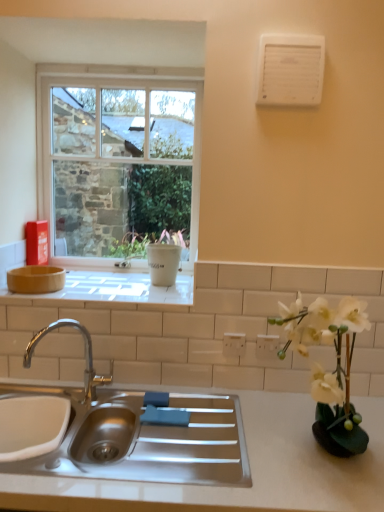
Question: In which direction should I rotate to look at white plastic electric outlet at center, placed as the second electric outlet when sorted from right to left?

Choices:
 (A) right
 (B) left

Answer: (A)

Question: Is white matte vase at right to the left of stainless steel sink at center from the viewer's perspective?

Choices:
 (A) no
 (B) yes

Answer: (A)

Question: Considering the relative sizes of white matte vase at right and stainless steel sink at center in the image provided, is white matte vase at right shorter than stainless steel sink at center?

Choices:
 (A) yes
 (B) no

Answer: (B)

Question: Is white matte vase at right at the right side of stainless steel sink at center?

Choices:
 (A) yes
 (B) no

Answer: (A)

Question: From the image's perspective, does white matte vase at right appear lower than stainless steel sink at center?

Choices:
 (A) yes
 (B) no

Answer: (B)

Question: From a real-world perspective, is white matte vase at right beneath stainless steel sink at center?

Choices:
 (A) yes
 (B) no

Answer: (B)

Question: Is white matte vase at right oriented away from stainless steel sink at center?

Choices:
 (A) yes
 (B) no

Answer: (B)

Question: From a real-world perspective, is white matte vase at upper center on stainless steel sink at center?

Choices:
 (A) no
 (B) yes

Answer: (B)

Question: From a real-world perspective, is white matte vase at upper center beneath stainless steel sink at center?

Choices:
 (A) no
 (B) yes

Answer: (A)

Question: From the image's perspective, is white matte vase at upper center beneath stainless steel sink at center?

Choices:
 (A) no
 (B) yes

Answer: (A)

Question: Could you tell me if white matte vase at upper center is facing stainless steel sink at center?

Choices:
 (A) yes
 (B) no

Answer: (B)

Question: Can you confirm if white matte vase at upper center is thinner than stainless steel sink at center?

Choices:
 (A) no
 (B) yes

Answer: (B)

Question: Are white matte vase at upper center and stainless steel sink at center located far from each other?

Choices:
 (A) no
 (B) yes

Answer: (A)

Question: Considering the relative sizes of matte white tile at upper center and white matte countertop at center in the image provided, is matte white tile at upper center bigger than white matte countertop at center?

Choices:
 (A) no
 (B) yes

Answer: (A)